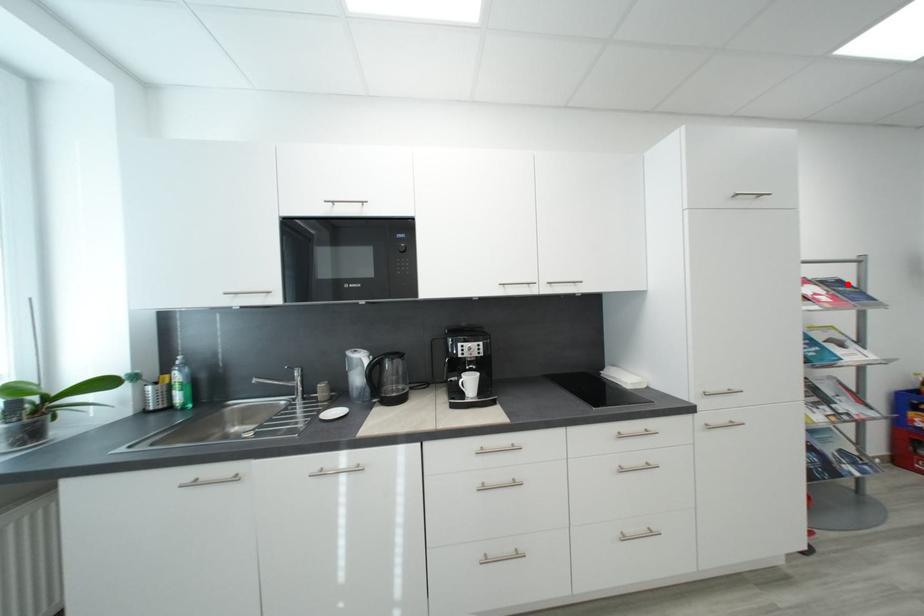
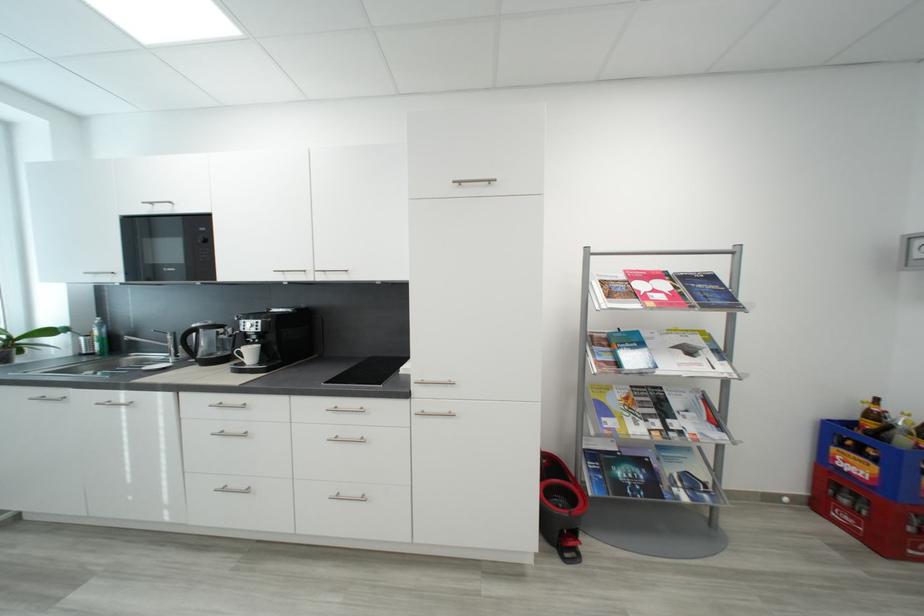
Find the pixel in the second image that matches the highlighted location in the first image.

(718, 280)